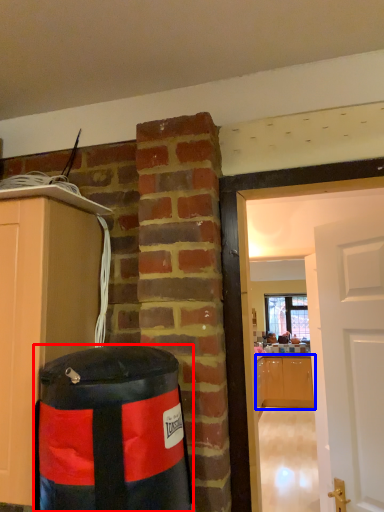
Question: Which point is closer to the camera, punching bag (highlighted by a red box) or cabinetry (highlighted by a blue box)?

Choices:
 (A) punching bag
 (B) cabinetry

Answer: (A)